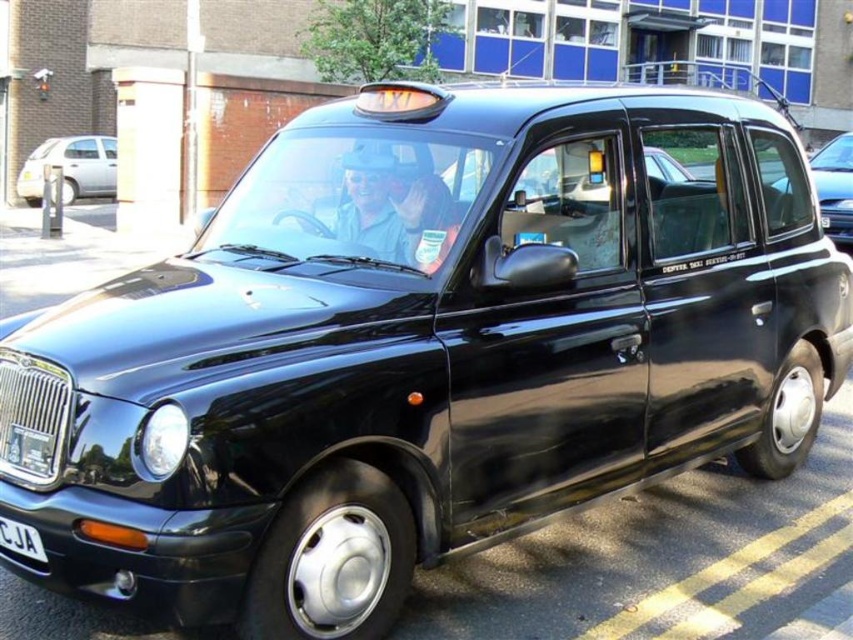
From the picture: Does black matte taxi at right have a greater width compared to white plastic license plate at lower left?

Yes.

Can you confirm if black matte taxi at right is taller than white plastic license plate at lower left?

Yes.

Find the location of a particular element. black matte taxi at right is located at coordinates (834, 186).

Can you confirm if silver metallic hatchback at left is positioned to the right of white plastic license plate at lower left?

Incorrect, silver metallic hatchback at left is not on the right side of white plastic license plate at lower left.

Does silver metallic hatchback at left have a greater height compared to white plastic license plate at lower left?

Correct, silver metallic hatchback at left is much taller as white plastic license plate at lower left.

Between point (109, 150) and point (26, 529), which one is positioned in front?

Positioned in front is point (26, 529).

Locate an element on the screen. silver metallic hatchback at left is located at coordinates (70, 168).

Does silver metallic hatchback at left appear on the left side of black matte taxi at right?

Indeed, silver metallic hatchback at left is positioned on the left side of black matte taxi at right.

Does silver metallic hatchback at left have a greater width compared to black matte taxi at right?

Incorrect, silver metallic hatchback at left's width does not surpass black matte taxi at right's.

Which is in front, point (33, 177) or point (836, 166)?

Point (836, 166) is more forward.

You are a GUI agent. You are given a task and a screenshot of the screen. Output one action in this format:
    pyautogui.click(x=<x>, y=<y>)
    Task: Click on the silver metallic hatchback at left
    The width and height of the screenshot is (853, 640).
    Given the screenshot: What is the action you would take?
    pyautogui.click(x=70, y=168)